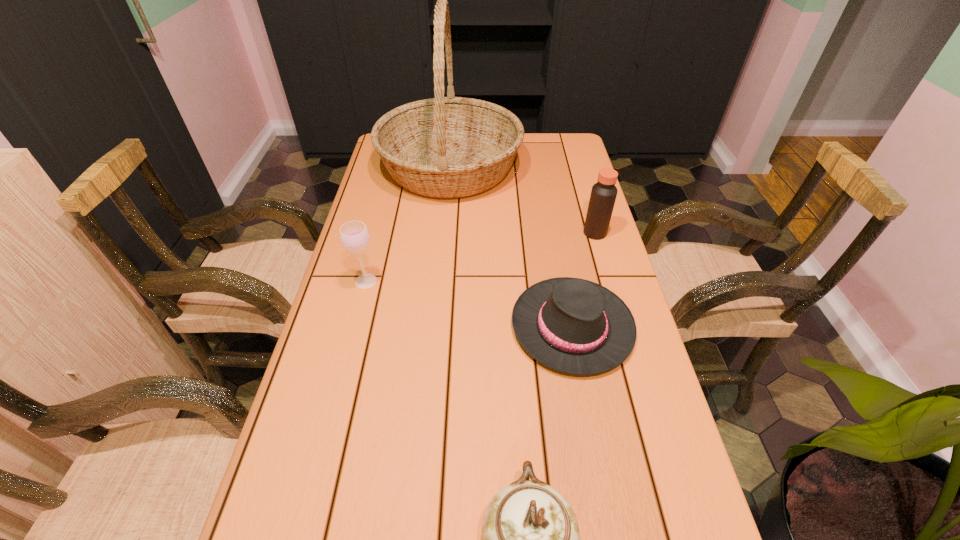
The image size is (960, 540). Find the location of `basket that is at the left edge`. basket that is at the left edge is located at coordinates (445, 147).

The width and height of the screenshot is (960, 540). I want to click on wineglass at the left edge, so (354, 236).

Identify the location of vinegar present at the right edge. (603, 194).

The height and width of the screenshot is (540, 960). I want to click on dress hat located at the right edge, so click(x=575, y=326).

The width and height of the screenshot is (960, 540). I want to click on object at the far left corner, so click(445, 147).

This screenshot has width=960, height=540. Identify the location of free space at the left edge. (389, 193).

In the image, there is a desktop. Where is `free region at the right edge`? This screenshot has height=540, width=960. free region at the right edge is located at coordinates (593, 414).

Find the location of `vacant area at the far right corner`. vacant area at the far right corner is located at coordinates (559, 156).

I want to click on vacant area between the vinegar and the basket, so click(522, 200).

Identify the location of vacant space that is in between the basket and the fourth nearest object. (522, 200).